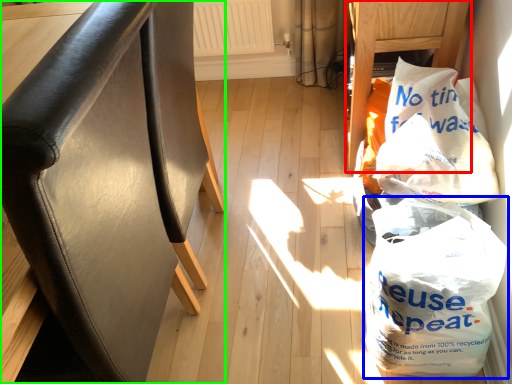
Question: Estimate the real-world distances between objects in this image. Which object is farther from furniture (highlighted by a red box), plastic bag (highlighted by a blue box) or furniture (highlighted by a green box)?

Choices:
 (A) plastic bag
 (B) furniture

Answer: (B)